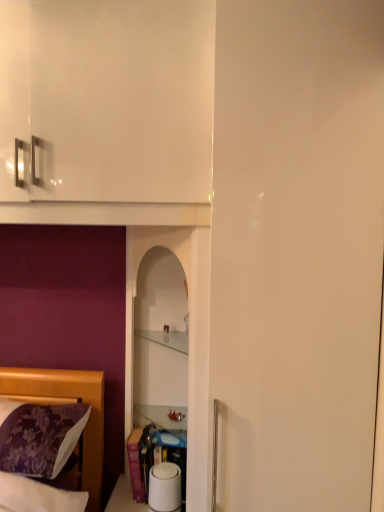
Question: From a real-world perspective, is transparent glass shelf at center located beneath purple floral fabric at lower left?

Choices:
 (A) no
 (B) yes

Answer: (A)

Question: Would you say transparent glass shelf at center is outside purple floral fabric at lower left?

Choices:
 (A) yes
 (B) no

Answer: (A)

Question: Is transparent glass shelf at center bigger than purple floral fabric at lower left?

Choices:
 (A) no
 (B) yes

Answer: (B)

Question: Is transparent glass shelf at center to the right of purple floral fabric at lower left from the viewer's perspective?

Choices:
 (A) no
 (B) yes

Answer: (B)

Question: From the image's perspective, is transparent glass shelf at center located beneath purple floral fabric at lower left?

Choices:
 (A) no
 (B) yes

Answer: (A)

Question: Does transparent glass shelf at center have a greater height compared to purple floral fabric at lower left?

Choices:
 (A) yes
 (B) no

Answer: (A)

Question: Is purple floral fabric at lower left to the right of clear glass cabinet at center from the viewer's perspective?

Choices:
 (A) yes
 (B) no

Answer: (B)

Question: Does purple floral fabric at lower left have a greater height compared to clear glass cabinet at center?

Choices:
 (A) yes
 (B) no

Answer: (A)

Question: Are purple floral fabric at lower left and clear glass cabinet at center making contact?

Choices:
 (A) no
 (B) yes

Answer: (A)

Question: Does purple floral fabric at lower left lie behind clear glass cabinet at center?

Choices:
 (A) yes
 (B) no

Answer: (B)

Question: Does purple floral fabric at lower left turn towards clear glass cabinet at center?

Choices:
 (A) yes
 (B) no

Answer: (B)

Question: From a real-world perspective, is purple floral fabric at lower left below clear glass cabinet at center?

Choices:
 (A) no
 (B) yes

Answer: (B)

Question: Could clear glass cabinet at center be considered to be inside transparent glass shelf at center?

Choices:
 (A) no
 (B) yes

Answer: (B)